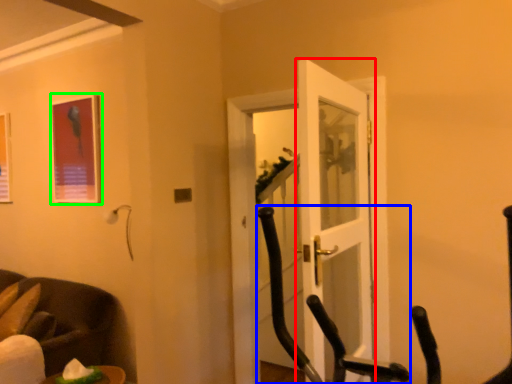
Question: Estimate the real-world distances between objects in this image. Which object is farther from door (highlighted by a red box), rocking chair (highlighted by a blue box) or picture frame (highlighted by a green box)?

Choices:
 (A) rocking chair
 (B) picture frame

Answer: (B)